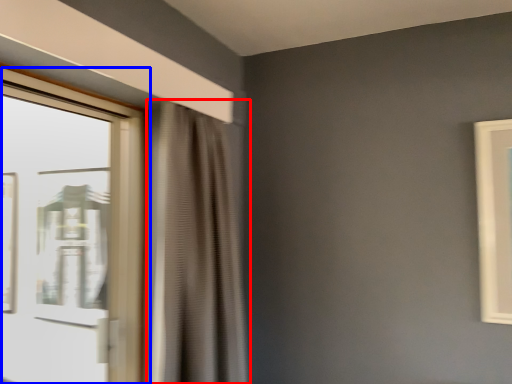
Question: Which object appears farthest to the camera in this image, curtain (highlighted by a red box) or window (highlighted by a blue box)?

Choices:
 (A) curtain
 (B) window

Answer: (A)